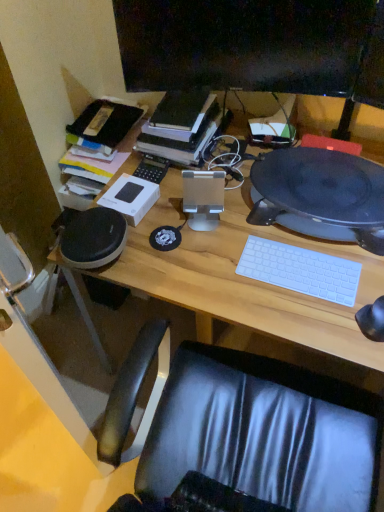
Locate an element on the screen. The height and width of the screenshot is (512, 384). free point above white matte keyboard at center (from a real-world perspective) is located at coordinates (298, 266).